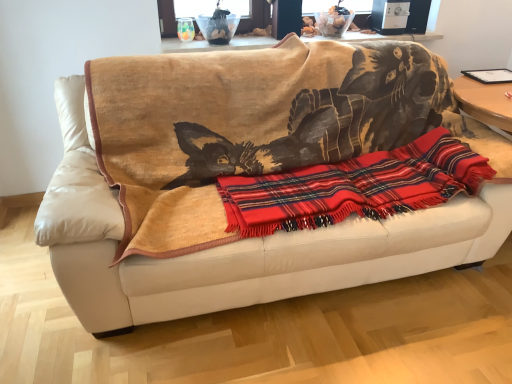
In order to face red plaid blanket at center, should I rotate leftwards or rightwards?

You should look right and rotate roughly 12.690 degrees.

Image resolution: width=512 pixels, height=384 pixels. Find the location of `red plaid blanket at center`. red plaid blanket at center is located at coordinates (354, 187).

Where is `wooden table at upper center`? wooden table at upper center is located at coordinates (218, 45).

Is beige leather couch at center not inside wooden table at upper center?

beige leather couch at center lies outside wooden table at upper center's area.

Are beige leather couch at center and wooden table at upper center making contact?

They are not placed beside each other.

Measure the distance between beige leather couch at center and wooden table at upper center.

beige leather couch at center and wooden table at upper center are 35.81 inches apart.

Which is more to the left, beige leather couch at center or wooden table at upper center?

From the viewer's perspective, beige leather couch at center appears more on the left side.

How much distance is there between beige leather couch at center and red plaid blanket at center?

beige leather couch at center is 9.75 inches away from red plaid blanket at center.

Considering the relative positions of beige leather couch at center and red plaid blanket at center in the image provided, is beige leather couch at center to the right of red plaid blanket at center from the viewer's perspective?

No.

Is beige leather couch at center not inside red plaid blanket at center?

Yes, beige leather couch at center is not within red plaid blanket at center.

Based on the photo, from a real-world perspective, is beige leather couch at center on red plaid blanket at center?

No, from a real-world perspective, beige leather couch at center is not above red plaid blanket at center.

Are red plaid blanket at center and beige leather couch at center far apart?

No, red plaid blanket at center is in close proximity to beige leather couch at center.

Locate an element on the screen. The height and width of the screenshot is (384, 512). studio couch on the left of the red plaid blanket at center is located at coordinates (242, 173).

Based on their sizes in the image, would you say red plaid blanket at center is bigger or smaller than beige leather couch at center?

red plaid blanket at center is smaller than beige leather couch at center.

Is point (406, 173) positioned in front of point (99, 288)?

No, (406, 173) is further to viewer.

From a real-world perspective, is red plaid blanket at center located beneath wooden table at upper center?

Yes.

In the scene shown: Is red plaid blanket at center positioned far away from wooden table at upper center?

red plaid blanket at center is near wooden table at upper center, not far away.

Considering the sizes of objects red plaid blanket at center and wooden table at upper center in the image provided, who is bigger, red plaid blanket at center or wooden table at upper center?

red plaid blanket at center.

Measure the distance from red plaid blanket at center to wooden table at upper center.

red plaid blanket at center and wooden table at upper center are 37.71 inches apart from each other.

From a real-world perspective, which is physically below, wooden table at upper center or red plaid blanket at center?

From a 3D spatial view, red plaid blanket at center is below.

Relative to red plaid blanket at center, is wooden table at upper center in front or behind?

Clearly, wooden table at upper center is behind red plaid blanket at center.

Is there a large distance between wooden table at upper center and red plaid blanket at center?

Actually, wooden table at upper center and red plaid blanket at center are a little close together.

Consider the image. Is red plaid blanket at center located within wooden table at upper center?

Definitely not — red plaid blanket at center is not inside wooden table at upper center.

From a real-world perspective, is wooden table at upper center located higher than beige leather couch at center?

Indeed, from a real-world perspective, wooden table at upper center stands above beige leather couch at center.

How much distance is there between wooden table at upper center and beige leather couch at center?

wooden table at upper center and beige leather couch at center are 90.95 centimeters apart.

Can you confirm if wooden table at upper center is smaller than beige leather couch at center?

Yes, wooden table at upper center is smaller than beige leather couch at center.

Which point is more forward, [208,49] or [119,122]?

Point [119,122]

The width and height of the screenshot is (512, 384). In order to click on table that is above the beige leather couch at center (from a real-world perspective) in this screenshot , I will do `click(218, 45)`.

You are a GUI agent. You are given a task and a screenshot of the screen. Output one action in this format:
    pyautogui.click(x=<x>, y=<y>)
    Task: Click on the cloth lying behind the beige leather couch at center
    The height and width of the screenshot is (384, 512).
    Given the screenshot: What is the action you would take?
    pyautogui.click(x=354, y=187)

Considering their positions, is beige leather couch at center positioned further to wooden table at upper center than red plaid blanket at center?

red plaid blanket at center lies further to wooden table at upper center than the other object.

Considering their positions, is wooden table at upper center positioned closer to beige leather couch at center than red plaid blanket at center?

red plaid blanket at center is positioned closer to the anchor beige leather couch at center.

From the picture: Which object lies nearer to the anchor point red plaid blanket at center, beige leather couch at center or wooden table at upper center?

Based on the image, beige leather couch at center appears to be nearer to red plaid blanket at center.

When comparing their distances from beige leather couch at center, does red plaid blanket at center or wooden table at upper center seem further?

Among the two, wooden table at upper center is located further to beige leather couch at center.

Considering their positions, is wooden table at upper center positioned closer to red plaid blanket at center than beige leather couch at center?

Based on the image, beige leather couch at center appears to be nearer to red plaid blanket at center.

Looking at the image, which one is located further to wooden table at upper center, red plaid blanket at center or beige leather couch at center?

red plaid blanket at center.

Identify the location of cloth between beige leather couch at center and wooden table at upper center from front to back. Image resolution: width=512 pixels, height=384 pixels. (354, 187).